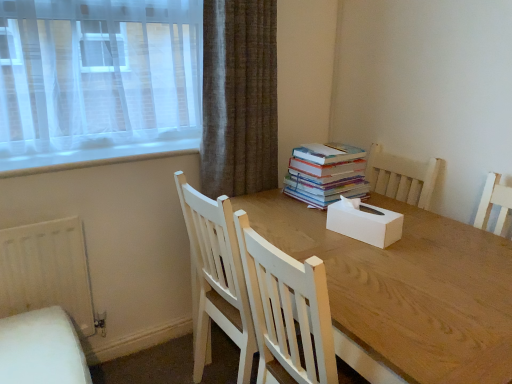
Find the location of a particular element. The height and width of the screenshot is (384, 512). unoccupied area in front of multicolored paper book at center is located at coordinates (303, 216).